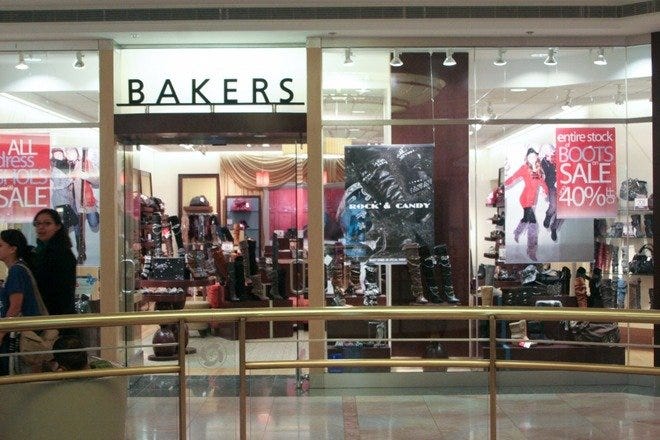
Identify the location of poster. Image resolution: width=660 pixels, height=440 pixels. (418, 183).